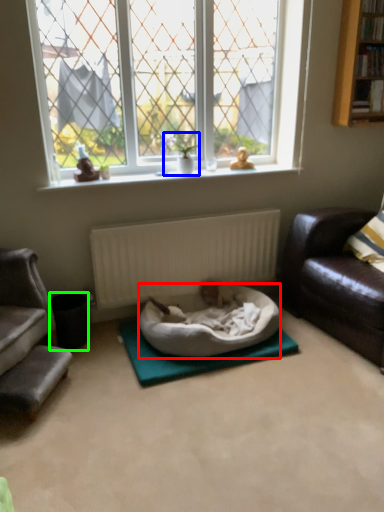
Question: Which object is the farthest from dog bed (highlighted by a red box)? Choose among these: houseplant (highlighted by a blue box) or trash bin/can (highlighted by a green box).

Choices:
 (A) houseplant
 (B) trash bin/can

Answer: (A)